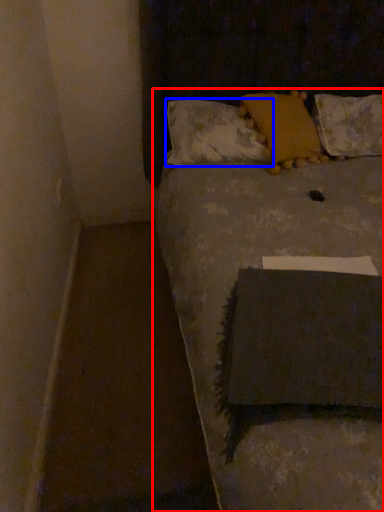
Question: Which point is further to the camera, furniture (highlighted by a red box) or pillow (highlighted by a blue box)?

Choices:
 (A) furniture
 (B) pillow

Answer: (B)